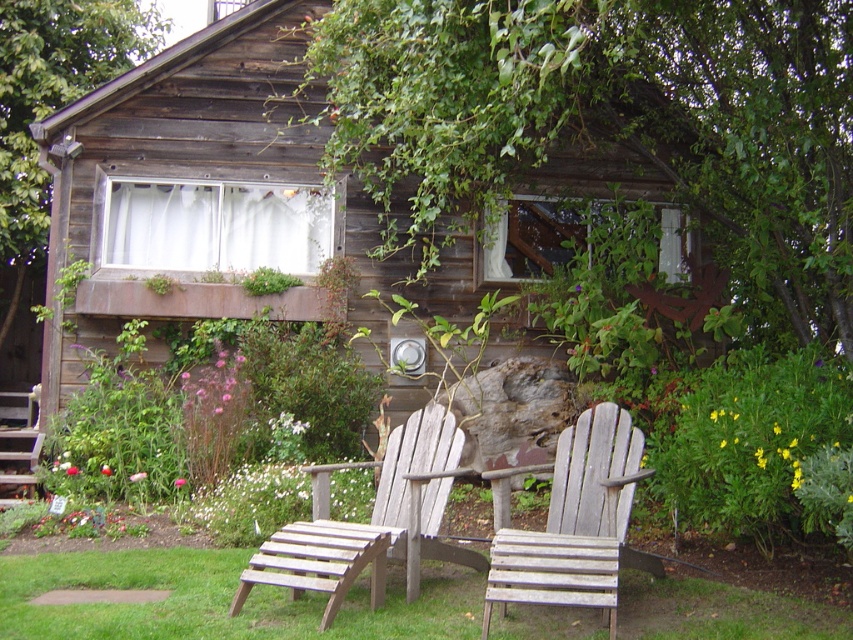
Question: Observing the image, what is the correct spatial positioning of gray wooden chair at center in reference to wooden slats chair at center?

Choices:
 (A) right
 (B) left

Answer: (A)

Question: Which point is farther to the camera?

Choices:
 (A) gray wooden chair at center
 (B) wooden slats chair at center

Answer: (B)

Question: Which object appears closest to the camera in this image?

Choices:
 (A) gray wooden chair at center
 (B) wooden slats chair at center

Answer: (A)

Question: Which of the following is the closest to the observer?

Choices:
 (A) 254,582
 (B) 573,506

Answer: (A)

Question: Does gray wooden chair at center lie behind wooden slats chair at center?

Choices:
 (A) no
 (B) yes

Answer: (A)

Question: Does gray wooden chair at center appear on the left side of wooden slats chair at center?

Choices:
 (A) no
 (B) yes

Answer: (A)